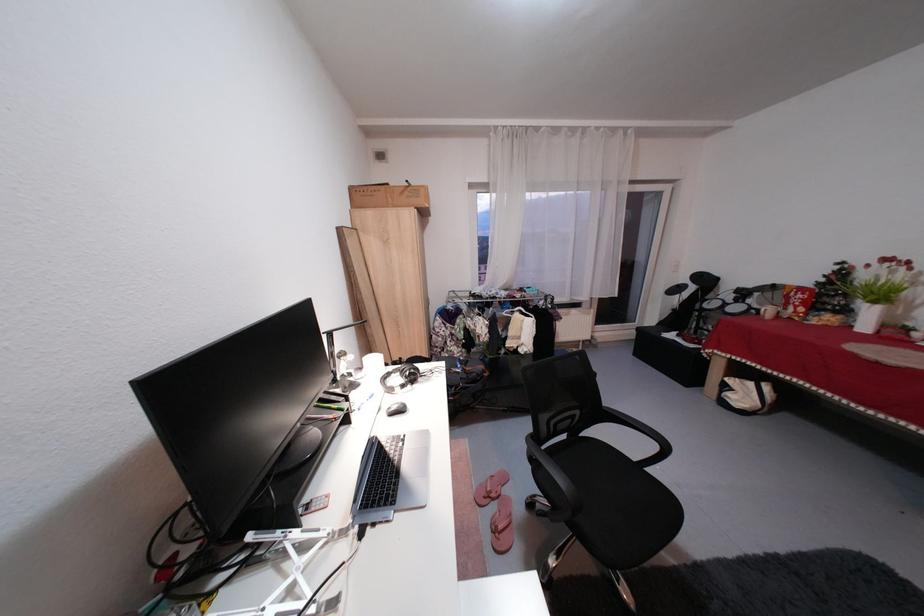
Where is `white tote bag`? white tote bag is located at coordinates (746, 395).